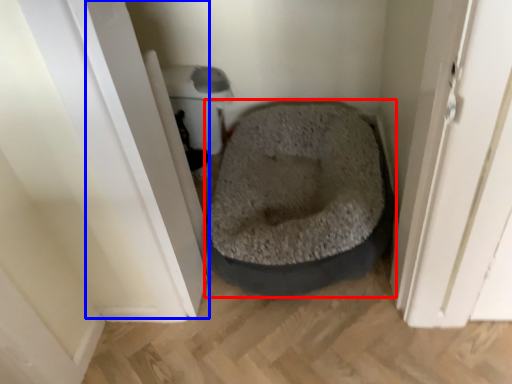
Question: Which point is closer to the camera, dog bed (highlighted by a red box) or screen door (highlighted by a blue box)?

Choices:
 (A) dog bed
 (B) screen door

Answer: (B)